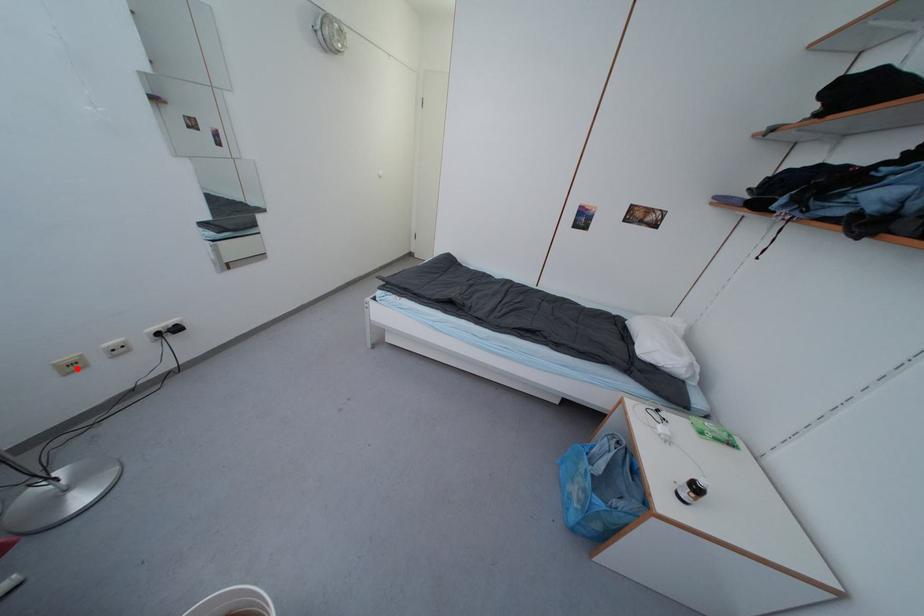
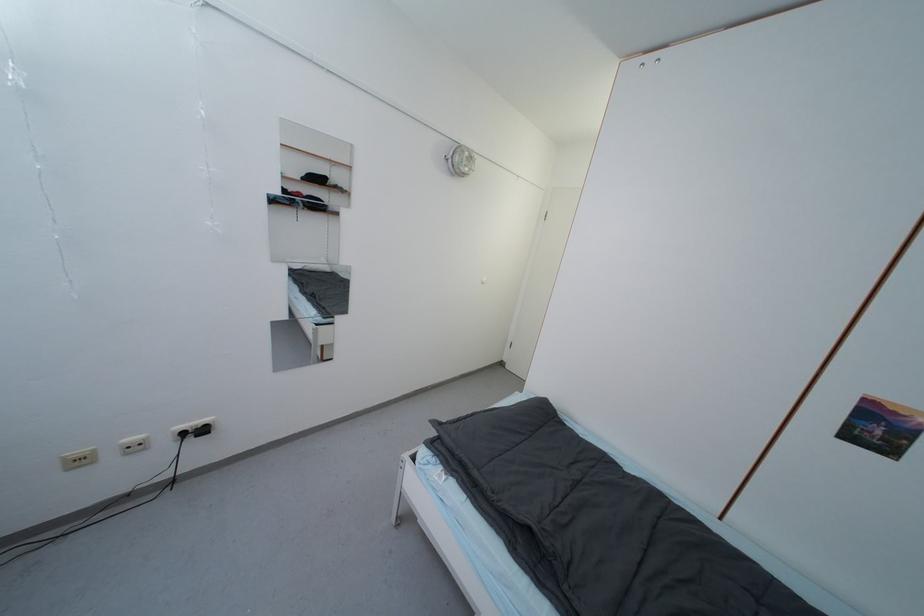
Question: I am providing you with two images of the same scene from different viewpoints. A red point is shown in image1. For the corresponding object point in image2, is it positioned nearer or farther from the camera?

Choices:
 (A) Nearer
 (B) Farther

Answer: (A)